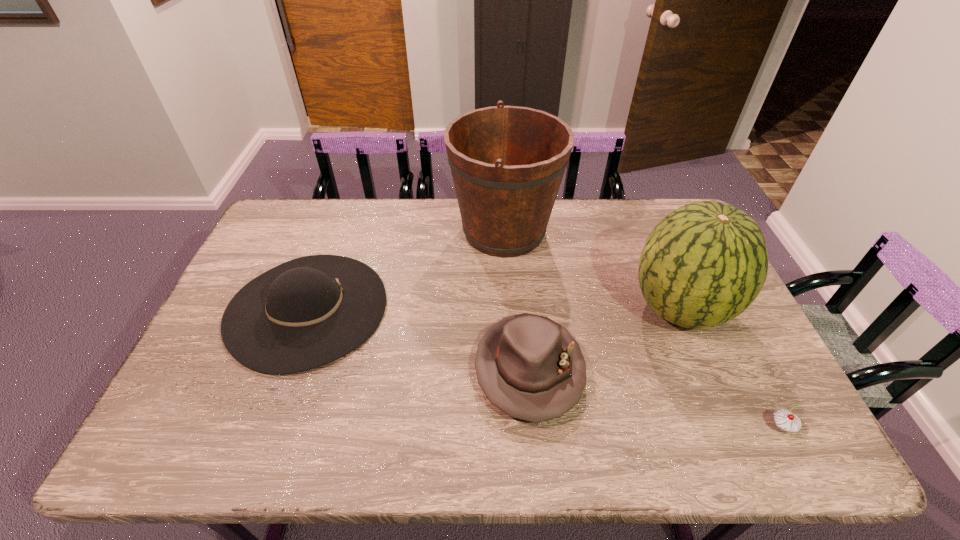
Find the location of a particular element. This screenshot has height=540, width=960. hat present at the near edge is located at coordinates (530, 367).

The height and width of the screenshot is (540, 960). In order to click on cupcake located in the near edge section of the desktop in this screenshot , I will do `click(785, 421)`.

Locate an element on the screen. The image size is (960, 540). object that is at the left edge is located at coordinates (307, 312).

Identify the location of watermelon that is positioned at the right edge. Image resolution: width=960 pixels, height=540 pixels. (703, 264).

I want to click on cupcake present at the right edge, so click(785, 421).

The image size is (960, 540). What are the coordinates of `object positioned at the near right corner` in the screenshot? It's located at (785, 421).

At what (x,y) coordinates should I click in order to perform the action: click on vacant region at the far edge of the desktop. Please return your answer as a coordinate pair (x, y). This screenshot has height=540, width=960. Looking at the image, I should click on (612, 224).

This screenshot has width=960, height=540. In the image, there is a desktop. Find the location of `vacant space at the near edge`. vacant space at the near edge is located at coordinates (383, 429).

Find the location of `vacant space at the left edge of the desktop`. vacant space at the left edge of the desktop is located at coordinates (213, 409).

In the image, there is a desktop. What are the coordinates of `vacant space at the right edge` in the screenshot? It's located at (740, 418).